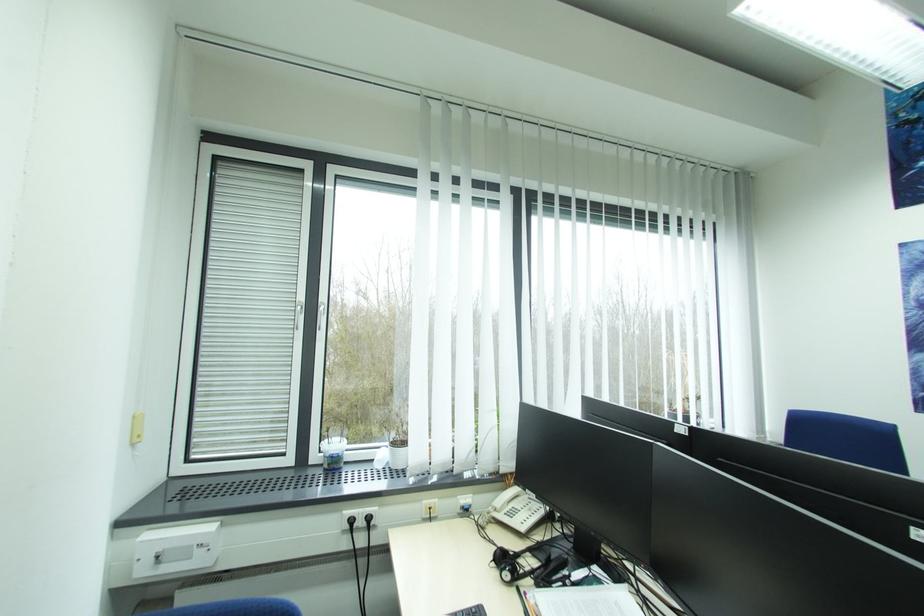
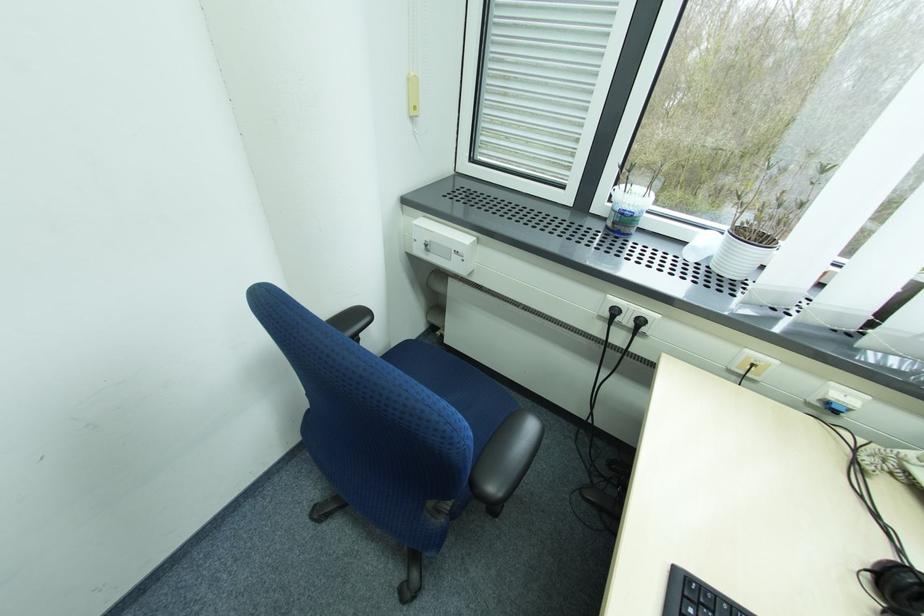
The first image is from the beginning of the video and the second image is from the end. How did the camera likely rotate when shooting the video?

The camera's rotation is toward left-down.